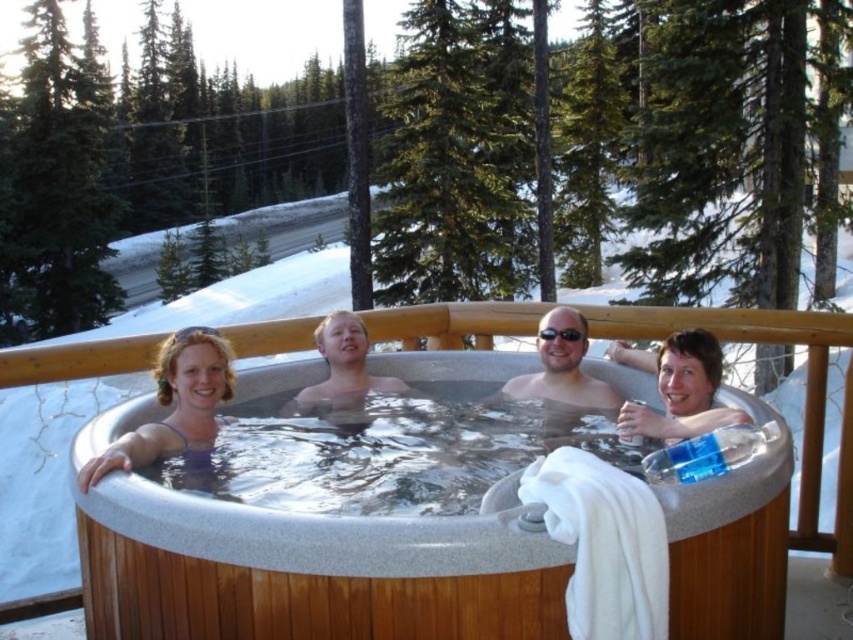
Is point (326, 344) farther from viewer compared to point (544, 337)?

Yes.

Who is positioned more to the right, matte purple swimsuit at center or black plastic goggles at center?

Positioned to the right is black plastic goggles at center.

Is point (291, 408) farther from viewer compared to point (582, 333)?

Yes, it is behind point (582, 333).

The image size is (853, 640). I want to click on matte purple swimsuit at center, so click(x=343, y=369).

Who is lower down, gray wood hot tub at center or matte plastic cup at upper right?

gray wood hot tub at center is below.

Image resolution: width=853 pixels, height=640 pixels. I want to click on gray wood hot tub at center, so click(306, 572).

Locate an element on the screen. The height and width of the screenshot is (640, 853). gray wood hot tub at center is located at coordinates (306, 572).

Who is higher up, matte wood hot tub at center or black plastic goggles at center?

black plastic goggles at center is higher up.

From the picture: Is matte wood hot tub at center above black plastic goggles at center?

Actually, matte wood hot tub at center is below black plastic goggles at center.

Does point (554, 323) lie behind point (560, 337)?

No, (554, 323) is in front of (560, 337).

Find the location of a particular element. Image resolution: width=853 pixels, height=640 pixels. matte wood hot tub at center is located at coordinates (561, 365).